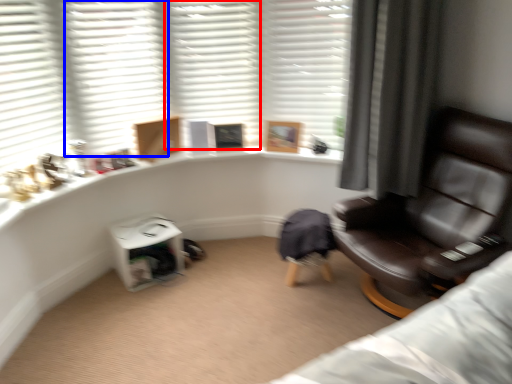
Question: Among these objects, which one is nearest to the camera, shutter (highlighted by a red box) or shutter (highlighted by a blue box)?

Choices:
 (A) shutter
 (B) shutter

Answer: (B)